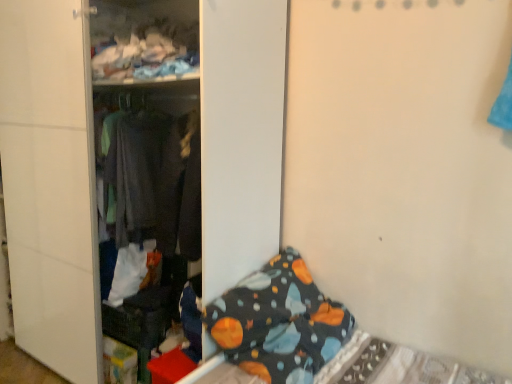
Question: From a real-world perspective, is dark gray fabric at center above or below dark blue fabric pillow at lower right?

Choices:
 (A) above
 (B) below

Answer: (A)

Question: Considering their positions, is dark gray fabric at center located in front of or behind dark blue fabric pillow at lower right?

Choices:
 (A) front
 (B) behind

Answer: (B)

Question: Which object is the farthest from the dark blue fabric blanket at lower right?

Choices:
 (A) dark gray fabric at center
 (B) dark blue fabric bed at lower right
 (C) dark blue fabric pillow at lower right

Answer: (B)

Question: Considering the real-world distances, which object is closest to the dark blue fabric pillow at lower right?

Choices:
 (A) dark blue fabric bed at lower right
 (B) dark blue fabric blanket at lower right
 (C) dark gray fabric at center

Answer: (A)